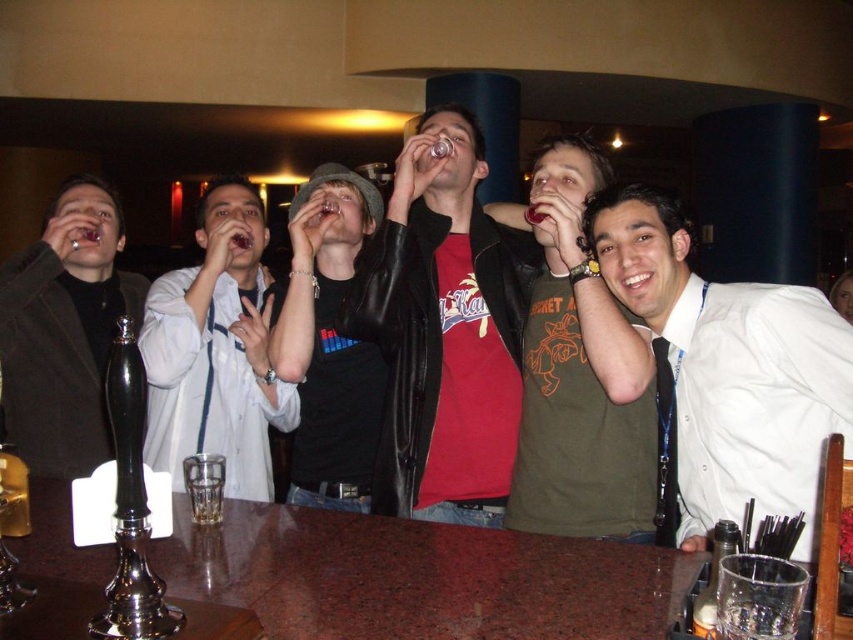
Question: Which point is closer to the camera?

Choices:
 (A) leather jacket at center
 (B) green matte t-shirt at center
 (C) white leather jacket at center

Answer: (B)

Question: Is white shirt at center wider than white leather jacket at center?

Choices:
 (A) no
 (B) yes

Answer: (B)

Question: Is green matte t-shirt at center behind matte black jacket at left?

Choices:
 (A) no
 (B) yes

Answer: (A)

Question: Can you confirm if white shirt at center is positioned to the right of leather jacket at center?

Choices:
 (A) no
 (B) yes

Answer: (B)

Question: Among these objects, which one is nearest to the camera?

Choices:
 (A) white shirt at center
 (B) black leather jacket at center

Answer: (A)

Question: Which point appears farthest from the camera in this image?

Choices:
 (A) (810, 410)
 (B) (294, 244)
 (C) (54, 445)
 (D) (531, 360)

Answer: (C)